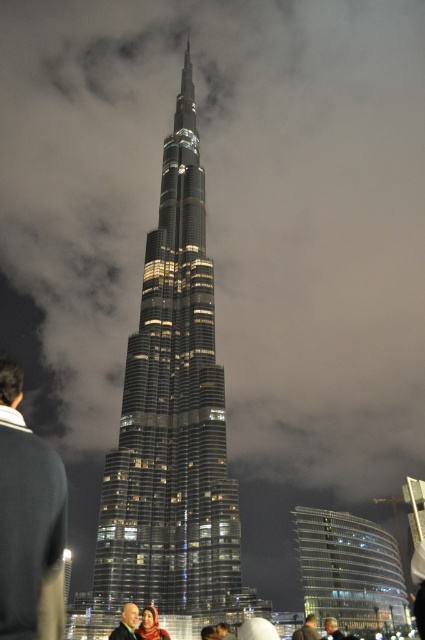
You are a photographer standing in the foreground of the Burj Khalifa scene. You want to capture a photo of the glassy metallic skyscraper at center without any obstructions. Is the dark blue sweater at lower left blocking your view of the skyscraper?

The glassy metallic skyscraper at center is positioned over the dark blue sweater at lower left, meaning the sweater is in front of the skyscraper. Therefore, the dark blue sweater at lower left would block your view of the glassy metallic skyscraper at center unless you move to a different angle.

You are standing at the origin point of the coordinate system. You want to take a photo of the glassy metallic skyscraper at center. Which direction should you move to get the best view?

The glassy metallic skyscraper at center is located at coordinate point 0.655 on the x axis and 0.407 on the y axis. Since you are at the origin, you should move towards the positive x and positive y direction to face the skyscraper.